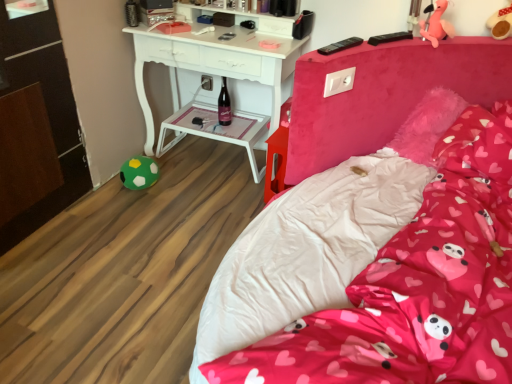
Question: Is pink plush toy at upper right, which is the second toy in top-to-bottom order, a part of pink fabric bed at center?

Choices:
 (A) yes
 (B) no

Answer: (B)

Question: Is pink fabric bed at center taller than pink plush toy at upper right, which is the second toy in top-to-bottom order?

Choices:
 (A) no
 (B) yes

Answer: (B)

Question: Is pink fabric bed at center to the right of pink plush toy at upper right, the 2th toy positioned from the bottom, from the viewer's perspective?

Choices:
 (A) yes
 (B) no

Answer: (B)

Question: Can you confirm if pink fabric bed at center is thinner than pink plush toy at upper right, which is the second toy in top-to-bottom order?

Choices:
 (A) yes
 (B) no

Answer: (B)

Question: Is pink fabric bed at center aimed at pink plush toy at upper right, which is the second toy in top-to-bottom order?

Choices:
 (A) yes
 (B) no

Answer: (B)

Question: In terms of size, does pink plush toy at upper right, which is the second toy in top-to-bottom order, appear bigger or smaller than matte glass bottle at center?

Choices:
 (A) big
 (B) small

Answer: (A)

Question: From a real-world perspective, relative to matte glass bottle at center, is pink plush toy at upper right, the 2th toy positioned from the bottom, vertically above or below?

Choices:
 (A) below
 (B) above

Answer: (B)

Question: Is pink plush toy at upper right, which is the second toy in left-to-right order, taller or shorter than matte glass bottle at center?

Choices:
 (A) short
 (B) tall

Answer: (A)

Question: From the image's perspective, is pink plush toy at upper right, the first toy viewed from the front, above or below matte glass bottle at center?

Choices:
 (A) above
 (B) below

Answer: (A)

Question: Considering the relative positions of pink plush toy at upper right, which is the second toy in left-to-right order, and pink fabric pillow at center in the image provided, is pink plush toy at upper right, which is the second toy in left-to-right order, to the left or to the right of pink fabric pillow at center?

Choices:
 (A) right
 (B) left

Answer: (B)

Question: Is pink plush toy at upper right, the third toy from the back, inside or outside of pink fabric pillow at center?

Choices:
 (A) outside
 (B) inside

Answer: (A)

Question: Considering the positions of pink plush toy at upper right, which is the second toy in left-to-right order, and pink fabric pillow at center in the image, is pink plush toy at upper right, which is the second toy in left-to-right order, bigger or smaller than pink fabric pillow at center?

Choices:
 (A) big
 (B) small

Answer: (B)

Question: In terms of height, does pink plush toy at upper right, which is the second toy in left-to-right order, look taller or shorter compared to pink fabric pillow at center?

Choices:
 (A) tall
 (B) short

Answer: (A)

Question: Is point (147, 160) positioned closer to the camera than point (227, 120)?

Choices:
 (A) farther
 (B) closer

Answer: (B)

Question: Looking at their shapes, would you say green felt ball at lower left, acting as the 3th toy starting from the top, is wider or thinner than matte glass bottle at center?

Choices:
 (A) wide
 (B) thin

Answer: (A)